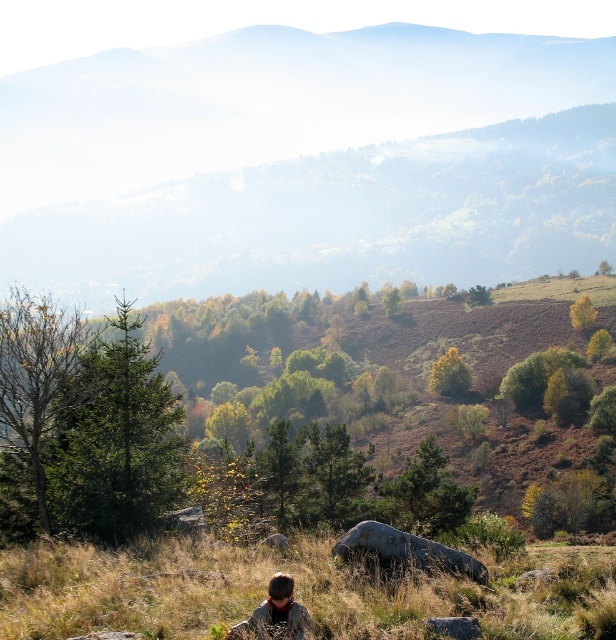
Is green leafy hillside at center positioned before green grass at lower center?

No.

Is point (95, 440) farther from viewer compared to point (545, 618)?

That is True.

The height and width of the screenshot is (640, 616). Find the location of `green leafy hillside at center`. green leafy hillside at center is located at coordinates (308, 404).

Does green leafy hillside at center appear on the left side of gray rough rock at center?

In fact, green leafy hillside at center is to the right of gray rough rock at center.

Between point (471, 317) and point (423, 561), which one is positioned in front?

Point (423, 561)

Who is more distant from viewer, (521, 376) or (423, 540)?

The point (521, 376) is behind.

At what (x,y) coordinates should I click in order to perform the action: click on green leafy hillside at center. Please return your answer as a coordinate pair (x, y). The image size is (616, 640). Looking at the image, I should click on (308, 404).

Is green leafy hillside at center bigger than brown hair at lower center?

Indeed, green leafy hillside at center has a larger size compared to brown hair at lower center.

The width and height of the screenshot is (616, 640). What do you see at coordinates (308, 404) in the screenshot?
I see `green leafy hillside at center` at bounding box center [308, 404].

Locate an element on the screen. The height and width of the screenshot is (640, 616). green leafy hillside at center is located at coordinates (308, 404).